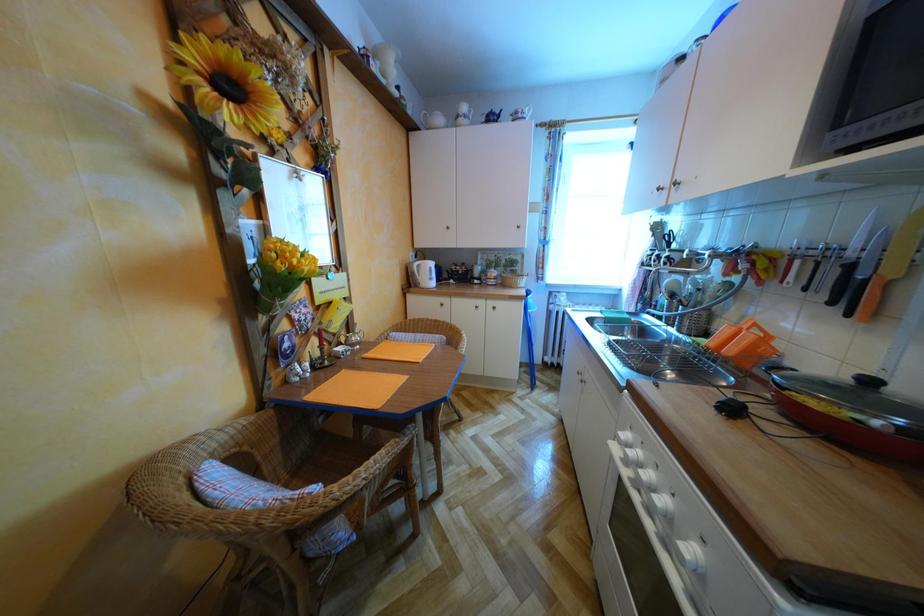
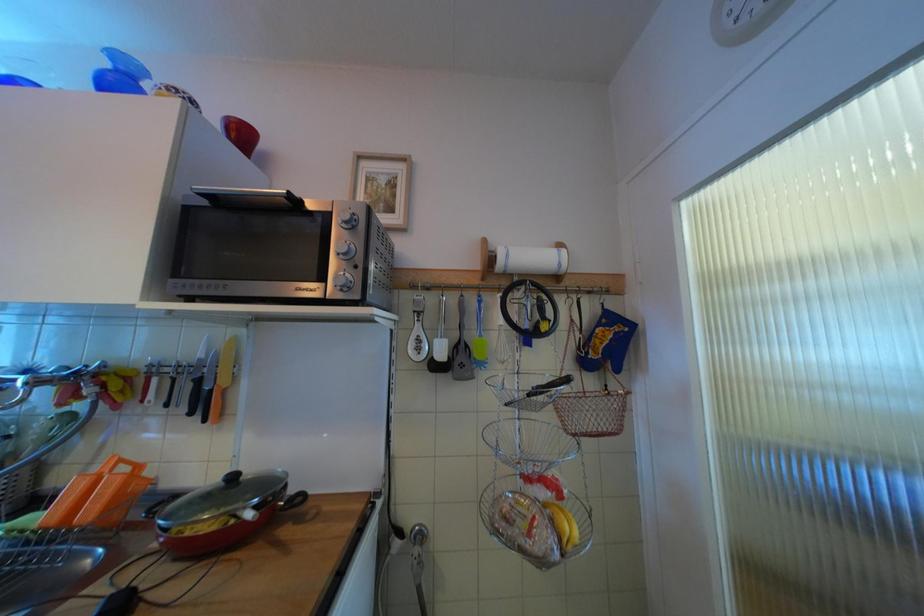
Question: Based on the continuous images, in which direction is the camera rotating? Reply with the corresponding letter.

Choices:
 (A) Left
 (B) Right
 (C) Up
 (D) Down

Answer: (B)